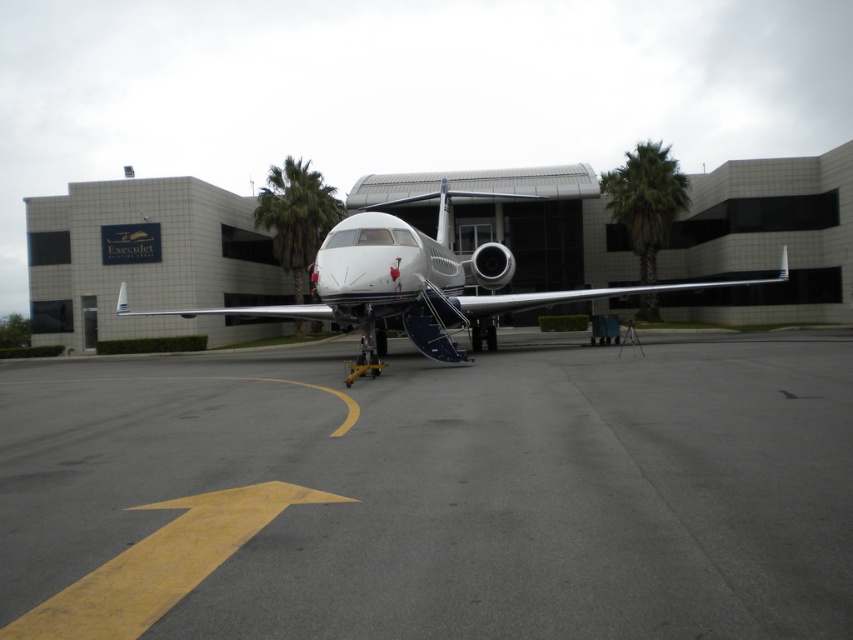
Is gray asphalt tarmac at center further to the viewer compared to white metallic airplane at center?

No, gray asphalt tarmac at center is in front of white metallic airplane at center.

Is point (9, 368) positioned behind point (506, 294)?

No, (9, 368) is in front of (506, 294).

The height and width of the screenshot is (640, 853). In order to click on gray asphalt tarmac at center in this screenshot , I will do pyautogui.click(x=434, y=492).